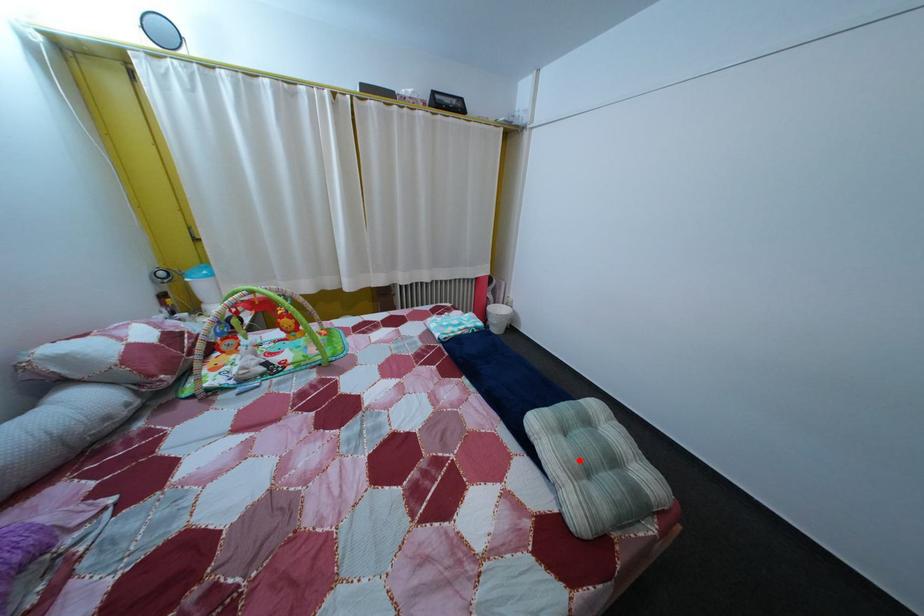
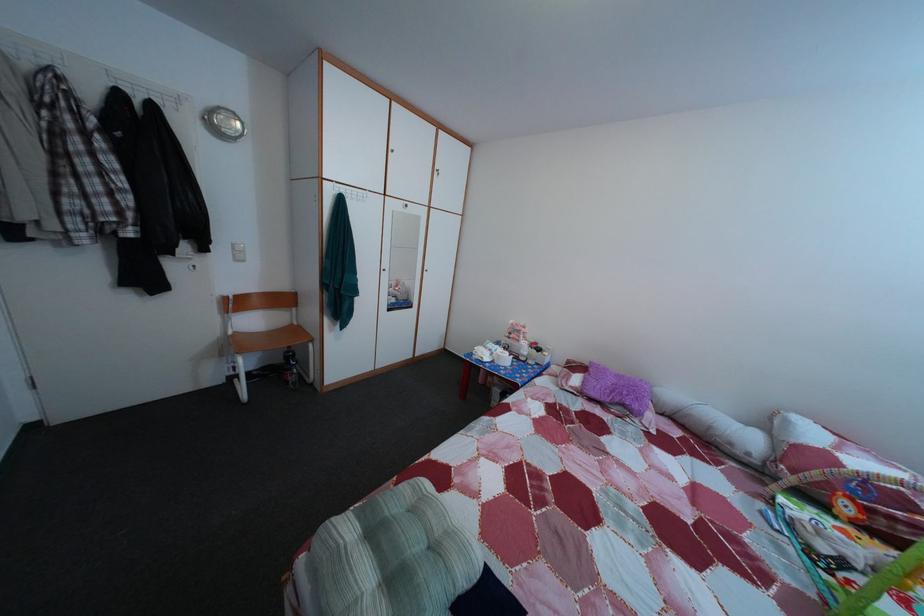
Find the pixel in the second image that matches the highlighted location in the first image.

(440, 521)